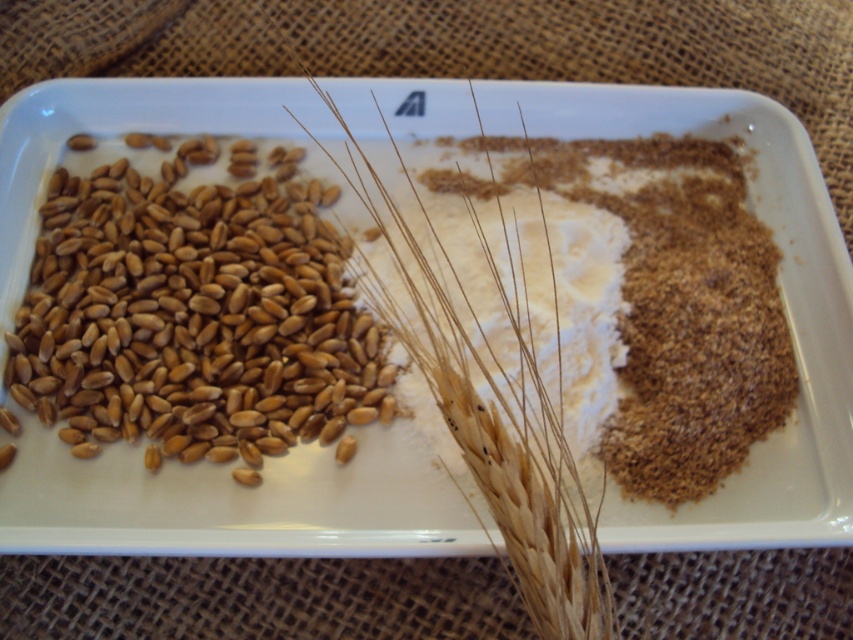
You are a chef preparing ingredients and see the brown matte wheat at upper left and the golden matte wheat grains at left in the dish. Which of these two wheat types is positioned higher in the dish?

The brown matte wheat at upper left is located above the golden matte wheat grains at left, so it is positioned higher in the dish.